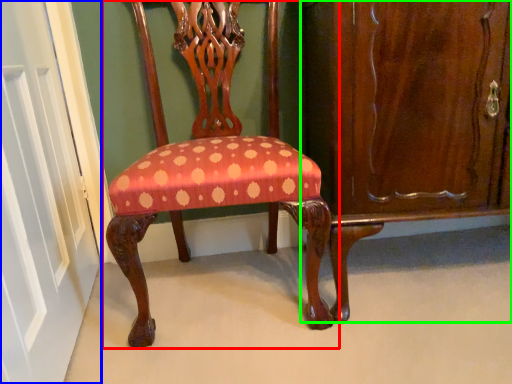
Question: Which is farther away from chair (highlighted by a red box)? door (highlighted by a blue box) or dresser (highlighted by a green box)?

Choices:
 (A) door
 (B) dresser

Answer: (A)